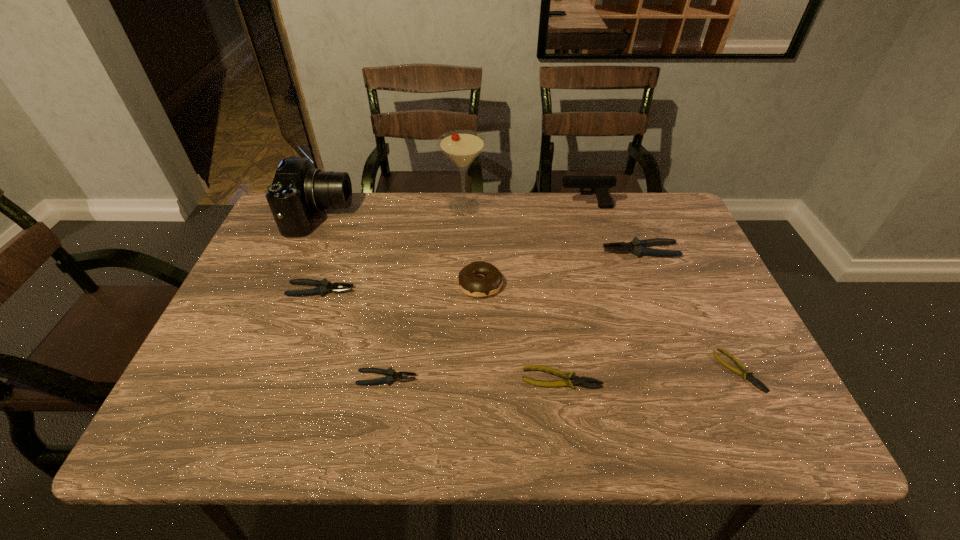
This screenshot has width=960, height=540. What are the coordinates of `pliers that is the closest to the smallest gray pliers` in the screenshot? It's located at (323, 286).

Where is `pliers that stands as the fourth closest to the third object from left to right`? pliers that stands as the fourth closest to the third object from left to right is located at coordinates (745, 373).

The width and height of the screenshot is (960, 540). Find the location of `the third closest gray pliers to the camera`. the third closest gray pliers to the camera is located at coordinates (638, 247).

Image resolution: width=960 pixels, height=540 pixels. In order to click on gray pliers that is the third closest to the tallest object in this screenshot , I will do `click(391, 375)`.

Locate an element on the screen. vacant space that satisfies the following two spatial constraints: 1. at the gripping part of the rightmost gray pliers; 2. on the right side of the shortest object is located at coordinates (686, 370).

Where is `free region that satisfies the following two spatial constraints: 1. at the gripping part of the farthest pliers; 2. on the back side of the right yellow pliers`? free region that satisfies the following two spatial constraints: 1. at the gripping part of the farthest pliers; 2. on the back side of the right yellow pliers is located at coordinates (686, 370).

In order to click on free region that satisfies the following two spatial constraints: 1. on the front-facing side of the seventh shortest object; 2. on the back side of the shortest pliers in this screenshot , I will do `click(633, 370)`.